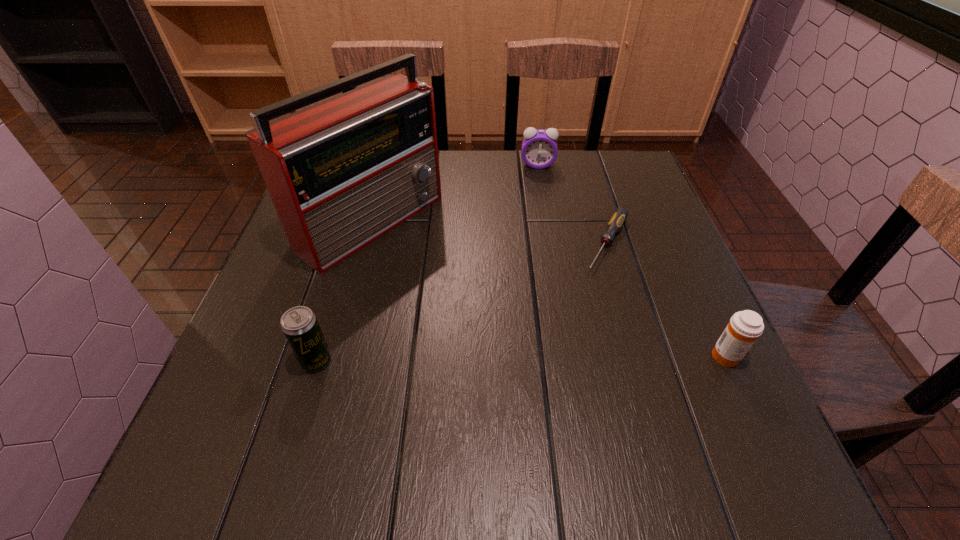
Locate an element on the screen. beer can is located at coordinates (299, 324).

You are a GUI agent. You are given a task and a screenshot of the screen. Output one action in this format:
    pyautogui.click(x=<x>, y=<y>)
    Task: Click on the rightmost object
    
    Given the screenshot: What is the action you would take?
    pyautogui.click(x=744, y=328)

Find the location of a particular element. The height and width of the screenshot is (540, 960). the shortest object is located at coordinates (620, 215).

At what (x,y) coordinates should I click in order to perform the action: click on screwdriver. Please return your answer as a coordinate pair (x, y). Looking at the image, I should click on (620, 215).

Locate an element on the screen. the farthest object is located at coordinates (539, 147).

This screenshot has width=960, height=540. I want to click on the third object from left to right, so click(539, 147).

Find the location of `radio receiver`. radio receiver is located at coordinates coord(341,173).

The image size is (960, 540). Identify the location of free space located on the back of the beer can. (357, 225).

At what (x,y) coordinates should I click in order to perform the action: click on free point located on the left of the medicine. Please return your answer as a coordinate pair (x, y). This screenshot has width=960, height=540. Looking at the image, I should click on (679, 356).

At what (x,y) coordinates should I click in order to perform the action: click on free spot located insert the screwdriver into a screw head. Please return your answer as a coordinate pair (x, y). Looking at the image, I should click on (540, 382).